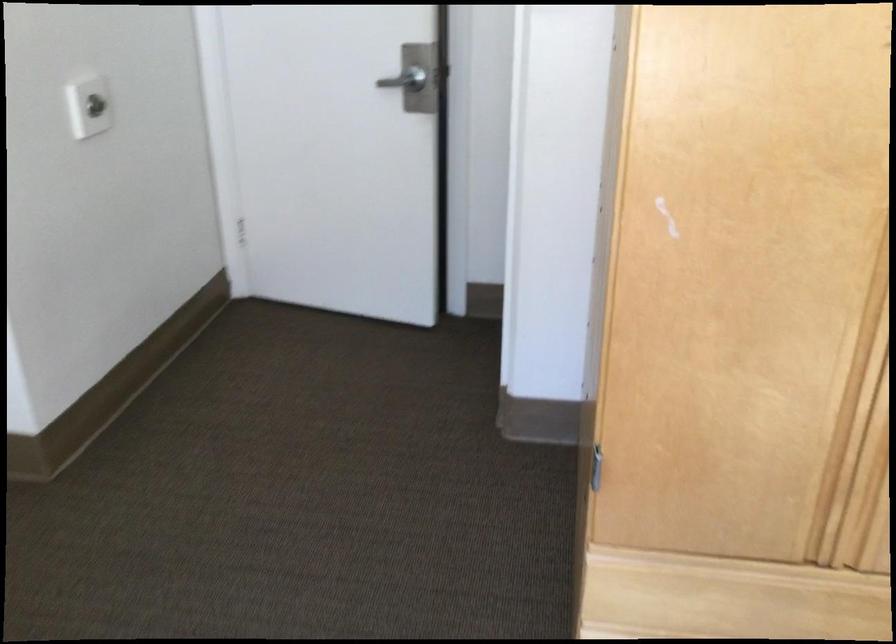
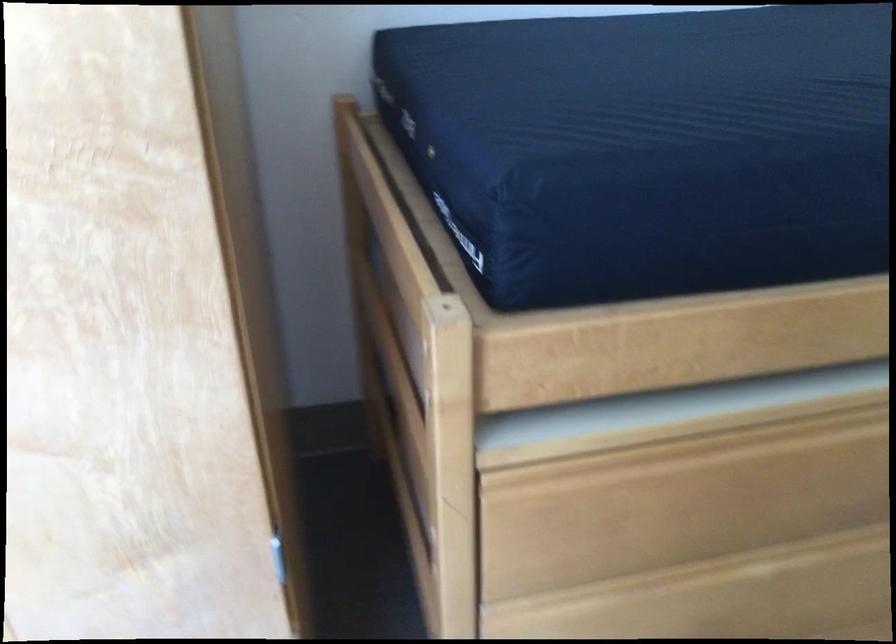
Question: Which direction would the cameraman need to move to produce the second image? Reply with the corresponding letter.

Choices:
 (A) Left
 (B) Right
 (C) Forward
 (D) Backward

Answer: (B)